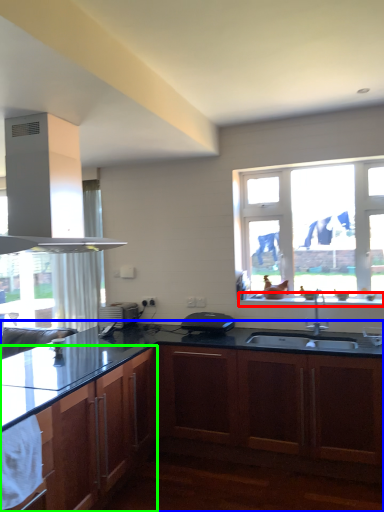
Question: Which object is the farthest from window sill (highlighted by a red box)? Choose among these: cabinetry (highlighted by a blue box) or cabinetry (highlighted by a green box).

Choices:
 (A) cabinetry
 (B) cabinetry

Answer: (B)